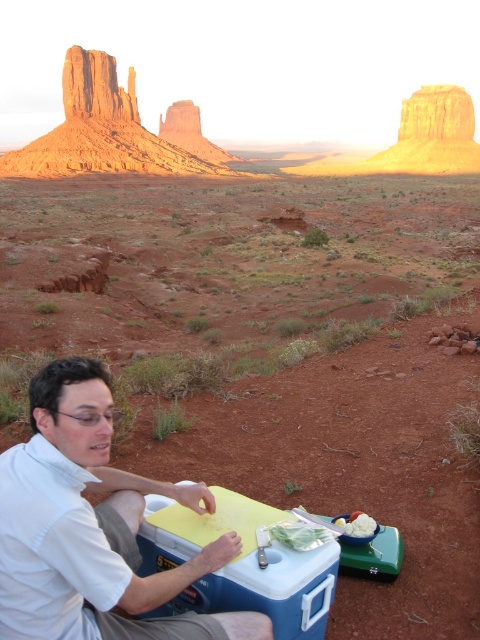
You are a photographer wanting to capture the man in the white matte shirt at lower left and the white fluffy ice cream at lower center in the same frame. Which object should you focus on first to ensure both are in focus?

The white matte shirt at lower left should be focused on first because it is larger and closer to the camera, ensuring both objects remain in focus.

From the picture: You are an observer standing in the desert scene. You notice an object labeled as the white matte shirt at lower left. Can you tell me its exact location coordinates?

The white matte shirt at lower left is located at point (92, 528).

Based on the photo, you are a hiker who needs to pack your backpack. You see the white matte shirt at lower left and the blue plastic cooler at lower center. Which item takes up more space in your backpack?

The white matte shirt at lower left is bigger than the blue plastic cooler at lower center, so it will take up more space in your backpack.